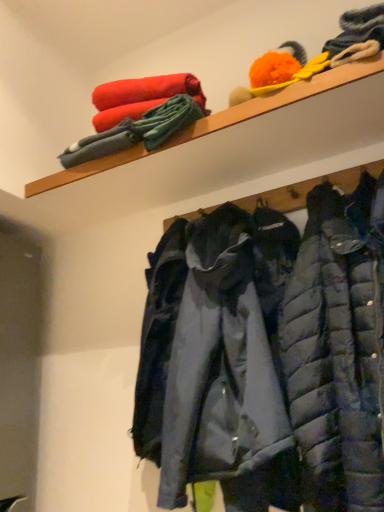
Question: Is wooden shelf at upper center taller than dark blue quilted jacket at center?

Choices:
 (A) no
 (B) yes

Answer: (A)

Question: Is wooden shelf at upper center to the left of dark blue quilted jacket at center from the viewer's perspective?

Choices:
 (A) no
 (B) yes

Answer: (B)

Question: Does wooden shelf at upper center have a greater width compared to dark blue quilted jacket at center?

Choices:
 (A) no
 (B) yes

Answer: (A)

Question: From a real-world perspective, is wooden shelf at upper center positioned under dark blue quilted jacket at center based on gravity?

Choices:
 (A) yes
 (B) no

Answer: (B)

Question: Is wooden shelf at upper center oriented away from dark blue quilted jacket at center?

Choices:
 (A) yes
 (B) no

Answer: (B)

Question: From the image's perspective, does wooden shelf at upper center appear higher than dark blue quilted jacket at center?

Choices:
 (A) no
 (B) yes

Answer: (B)

Question: From a real-world perspective, is dark blue quilted jacket at center physically above wooden shelf at upper center?

Choices:
 (A) no
 (B) yes

Answer: (A)

Question: Is dark blue quilted jacket at center oriented away from wooden shelf at upper center?

Choices:
 (A) no
 (B) yes

Answer: (A)

Question: Is dark blue quilted jacket at center surrounding wooden shelf at upper center?

Choices:
 (A) yes
 (B) no

Answer: (B)

Question: Does dark blue quilted jacket at center have a lesser height compared to wooden shelf at upper center?

Choices:
 (A) yes
 (B) no

Answer: (B)

Question: Considering the relative positions of dark blue quilted jacket at center and wooden shelf at upper center in the image provided, is dark blue quilted jacket at center to the right of wooden shelf at upper center from the viewer's perspective?

Choices:
 (A) yes
 (B) no

Answer: (A)

Question: Is dark blue quilted jacket at center not inside wooden shelf at upper center?

Choices:
 (A) no
 (B) yes

Answer: (B)

Question: From the image's perspective, relative to dark blue quilted jacket at center, is wooden shelf at upper center above or below?

Choices:
 (A) above
 (B) below

Answer: (A)